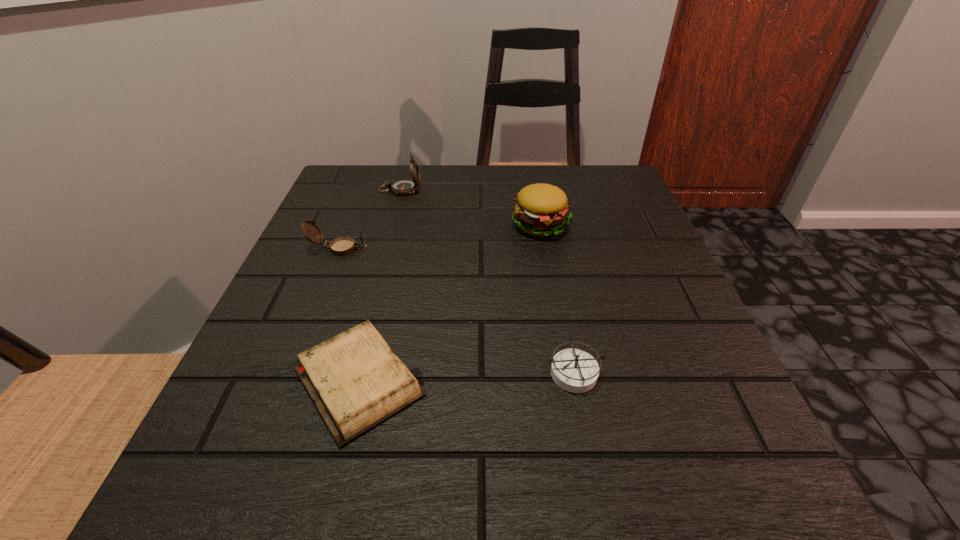
You are a GUI agent. You are given a task and a screenshot of the screen. Output one action in this format:
    pyautogui.click(x=<x>, y=<y>)
    Task: Click on the free space between the rightmost compass and the hamburger
    This screenshot has width=960, height=540.
    Given the screenshot: What is the action you would take?
    pyautogui.click(x=558, y=299)

This screenshot has width=960, height=540. Identify the location of free space between the second nearest compass and the nearest compass. (456, 310).

Locate an element on the screen. The height and width of the screenshot is (540, 960). free spot between the shortest object and the nearest compass is located at coordinates 466,376.

The height and width of the screenshot is (540, 960). In order to click on free point between the farthest compass and the hamburger in this screenshot , I will do `click(470, 207)`.

Locate an element on the screen. The height and width of the screenshot is (540, 960). vacant area that lies between the shortest object and the hamburger is located at coordinates (450, 303).

The height and width of the screenshot is (540, 960). What are the coordinates of `unoccupied area between the diary and the tallest compass` in the screenshot? It's located at (379, 285).

Where is `free space between the second shortest object and the second tallest compass`? This screenshot has width=960, height=540. free space between the second shortest object and the second tallest compass is located at coordinates (456, 310).

Find the location of a particular element. vacant space in between the nearest compass and the tallest compass is located at coordinates (487, 281).

Locate an element on the screen. This screenshot has height=540, width=960. free spot between the shortest object and the farthest compass is located at coordinates (379, 285).

Identify the location of object that is the fourth closest one to the hamburger. (342, 246).